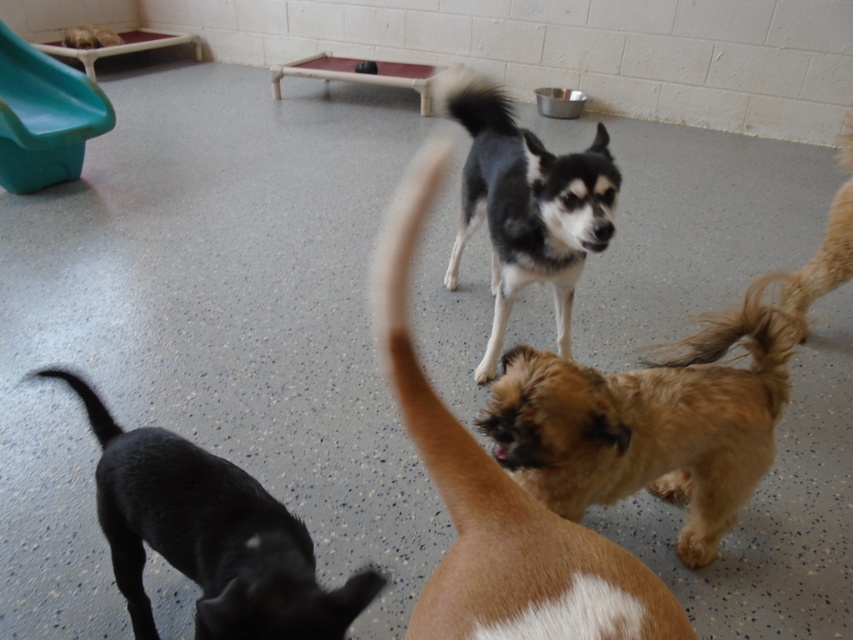
Does light brown fur at center have a lesser height compared to short-haired tan dog at center?

Correct, light brown fur at center is not as tall as short-haired tan dog at center.

Who is more distant from viewer, [767,337] or [523,624]?

The point [767,337] is more distant.

You are a GUI agent. You are given a task and a screenshot of the screen. Output one action in this format:
    pyautogui.click(x=<x>, y=<y>)
    Task: Click on the light brown fur at center
    The height and width of the screenshot is (640, 853).
    Given the screenshot: What is the action you would take?
    pyautogui.click(x=648, y=424)

Locate an element on the screen. Image resolution: width=853 pixels, height=640 pixels. light brown fur at center is located at coordinates (648, 424).

Can you confirm if short-haired tan dog at center is positioned to the left of black fur tail at lower left?

Incorrect, short-haired tan dog at center is not on the left side of black fur tail at lower left.

Which is behind, point (560, 538) or point (91, 424)?

Point (91, 424)

Locate an element on the screen. The width and height of the screenshot is (853, 640). short-haired tan dog at center is located at coordinates (496, 493).

Does short-haired tan dog at center appear under black and white fur at center?

Correct, short-haired tan dog at center is located below black and white fur at center.

Describe the element at coordinates (496, 493) in the screenshot. I see `short-haired tan dog at center` at that location.

What do you see at coordinates (496, 493) in the screenshot? This screenshot has height=640, width=853. I see `short-haired tan dog at center` at bounding box center [496, 493].

The image size is (853, 640). Identify the location of short-haired tan dog at center. (496, 493).